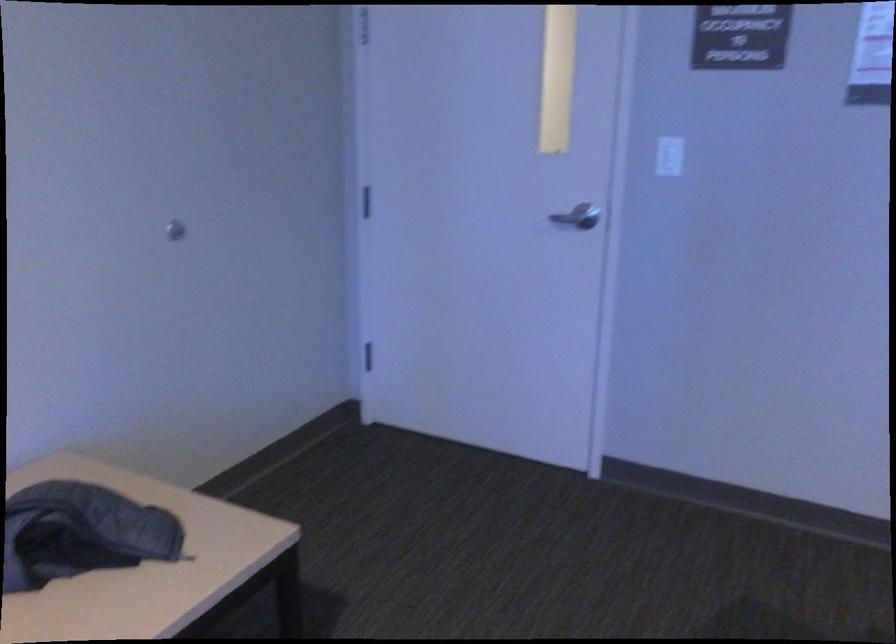
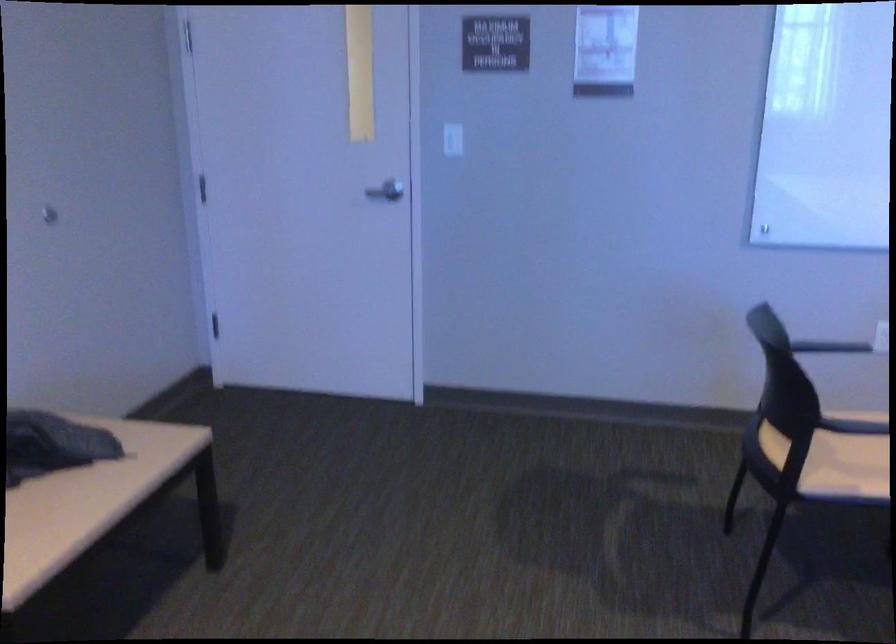
Question: The camera is either moving clockwise (left) or counter-clockwise (right) around the object. The first image is from the beginning of the video and the second image is from the end. Is the camera moving left or right when shooting the video?

Choices:
 (A) Left
 (B) Right

Answer: (A)